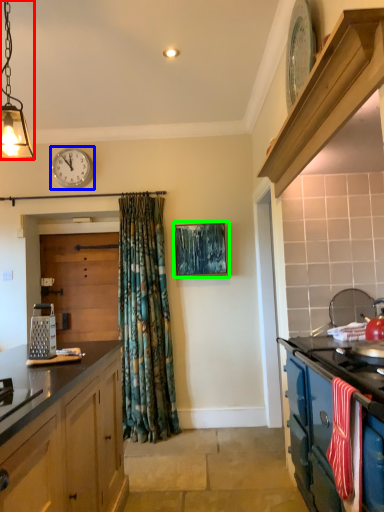
Question: Which object is the closest to the light fixture (highlighted by a red box)? Choose among these: clock (highlighted by a blue box) or picture frame (highlighted by a green box).

Choices:
 (A) clock
 (B) picture frame

Answer: (A)